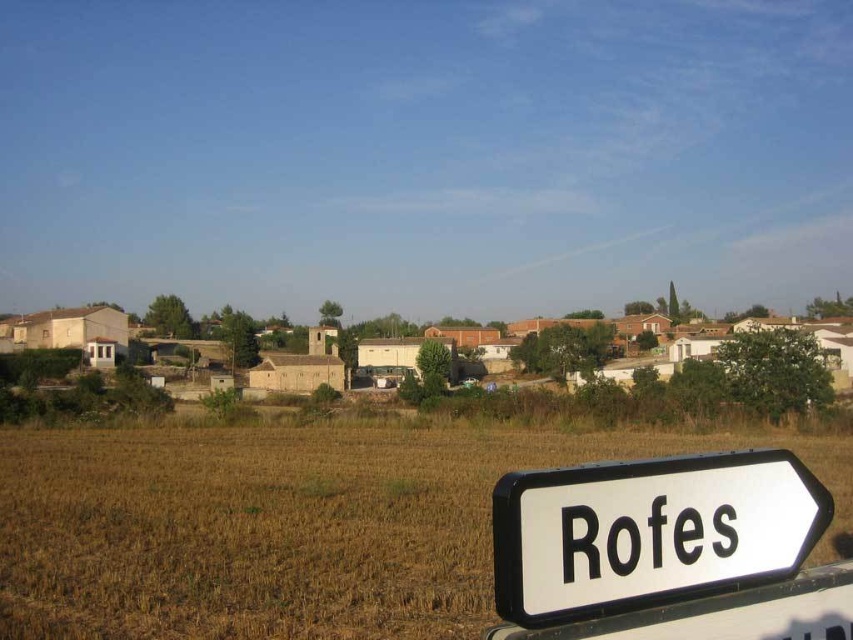
Measure the distance between point (822, 474) and camera.

Point (822, 474) is 21.99 meters from camera.

Who is more forward, (178,531) or (720,460)?

Point (720,460) is more forward.

At what (x,y) coordinates should I click in order to perform the action: click on brown grassland at lower left. Please return your answer as a coordinate pair (x, y). Looking at the image, I should click on (289, 525).